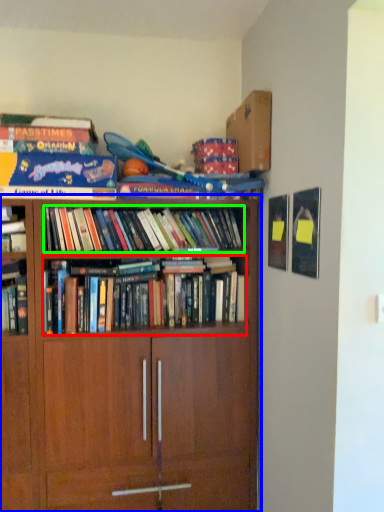
Question: Which object is positioned closest to book (highlighted by a red box)? Select from bookcase (highlighted by a blue box) and book (highlighted by a green box).

Choices:
 (A) bookcase
 (B) book

Answer: (B)